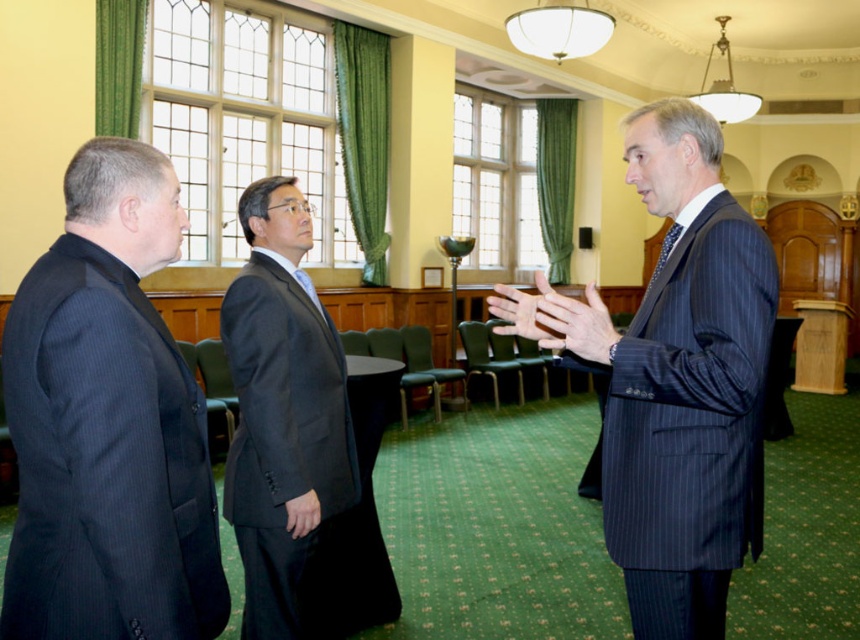
You are a photographer setting up for a group photo in this conference room. You need to position the two men wearing the pinstriped suit at center and the dark gray suit at center so that they appear the same size in the photo. Which man should you move closer to the camera?

The pinstriped suit at center is smaller than the dark gray suit at center, so you should move the man in the pinstriped suit at center closer to the camera to make them appear the same size in the photo.

You are standing in the conference room and want to know which of the two points, point 1 at coordinates point (109, 493) or point 2 at coordinates point (729, 456), is closer to you. Which one is closer?

Point (109, 493) is closer to the camera than point (729, 456), so it is closer to you.

Based on the photo, you are standing in the conference room and need to take a photo of the dark pinstripe suit at left. The camera you have is 4.8 feet away from the suit. Is the camera close enough to capture a clear photo?

The dark pinstripe suit at left and camera are 4.91 feet apart. Since the camera is only 4.8 feet away from the suit, it is slightly closer than the required distance, so the camera is close enough to capture a clear photo.